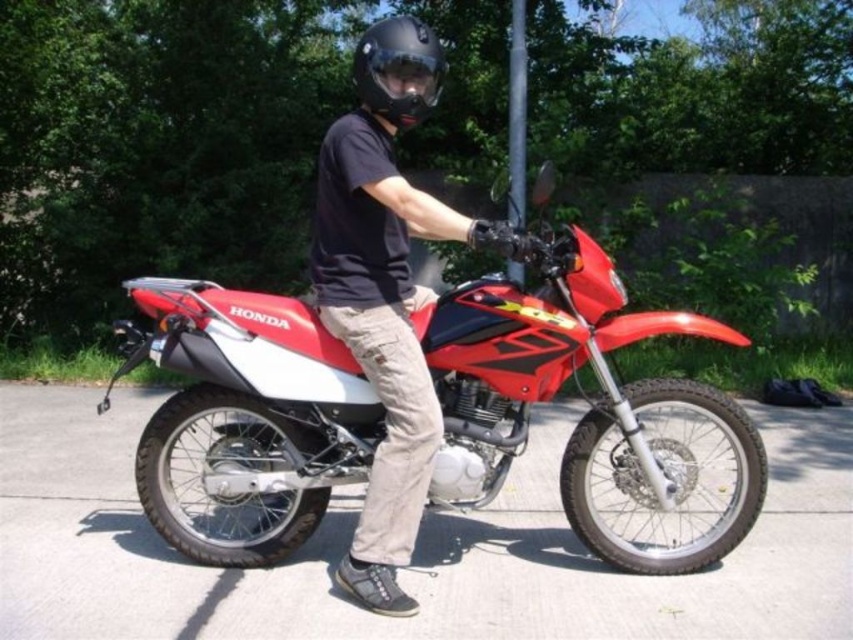
Does red matte/satin motorcycle at center have a lesser width compared to matte black goggles at center?

No, red matte/satin motorcycle at center is not thinner than matte black goggles at center.

From the picture: Can you confirm if red matte/satin motorcycle at center is taller than matte black goggles at center?

Yes, red matte/satin motorcycle at center is taller than matte black goggles at center.

Between point (715, 552) and point (386, 58), which one is positioned in front?

Point (386, 58)

At what (x,y) coordinates should I click in order to perform the action: click on red matte/satin motorcycle at center. Please return your answer as a coordinate pair (x, y). This screenshot has height=640, width=853. Looking at the image, I should click on (587, 400).

Is black matte helmet at center smaller than matte black goggles at center?

No, black matte helmet at center is not smaller than matte black goggles at center.

Which of these two, black matte helmet at center or matte black goggles at center, stands shorter?

Standing shorter between the two is matte black goggles at center.

Measure the distance between black matte helmet at center and camera.

A distance of 3.37 meters exists between black matte helmet at center and camera.

Locate an element on the screen. The height and width of the screenshot is (640, 853). black matte helmet at center is located at coordinates pos(398,68).

Does matte black helmet at center appear under matte black goggles at center?

Indeed, matte black helmet at center is positioned under matte black goggles at center.

Is the position of matte black helmet at center more distant than that of matte black goggles at center?

No.

Find the location of a particular element. The height and width of the screenshot is (640, 853). matte black helmet at center is located at coordinates (384, 330).